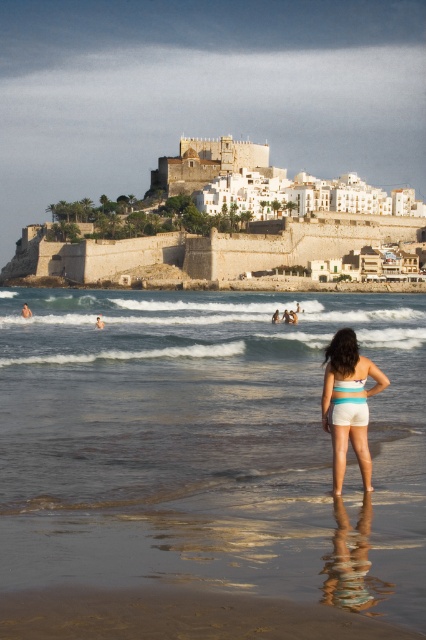
Who is positioned more to the left, white matte bikini at center or multicolored fabric bikini top at center?

Positioned to the left is white matte bikini at center.

Does white matte bikini at center have a greater width compared to multicolored fabric bikini top at center?

Indeed, white matte bikini at center has a greater width compared to multicolored fabric bikini top at center.

Locate an element on the screen. This screenshot has height=640, width=426. white matte bikini at center is located at coordinates (348, 410).

What are the coordinates of `white matte bikini at center` in the screenshot? It's located at (348, 410).

The image size is (426, 640). Identify the location of blue striped shorts at center. (348, 404).

Is point (368, 486) in front of point (351, 381)?

Yes, it is in front of point (351, 381).

Is point (379, 372) farther from camera compared to point (345, 390)?

Yes.

Where is `blue striped shorts at center`? blue striped shorts at center is located at coordinates (348, 404).

Is clear water at center bigger than white matte bikini at center?

Indeed, clear water at center has a larger size compared to white matte bikini at center.

Who is positioned more to the left, clear water at center or white matte bikini at center?

clear water at center

Does point (273, 474) lie behind point (345, 381)?

No, it is not.

Find the location of a particular element. This screenshot has width=426, height=640. clear water at center is located at coordinates (207, 445).